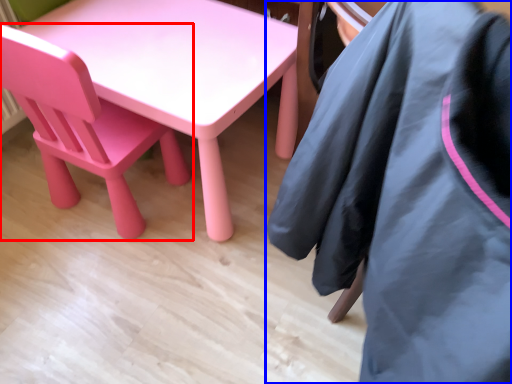
Question: Which point is further to the camera, chair (highlighted by a red box) or jacket (highlighted by a blue box)?

Choices:
 (A) chair
 (B) jacket

Answer: (A)